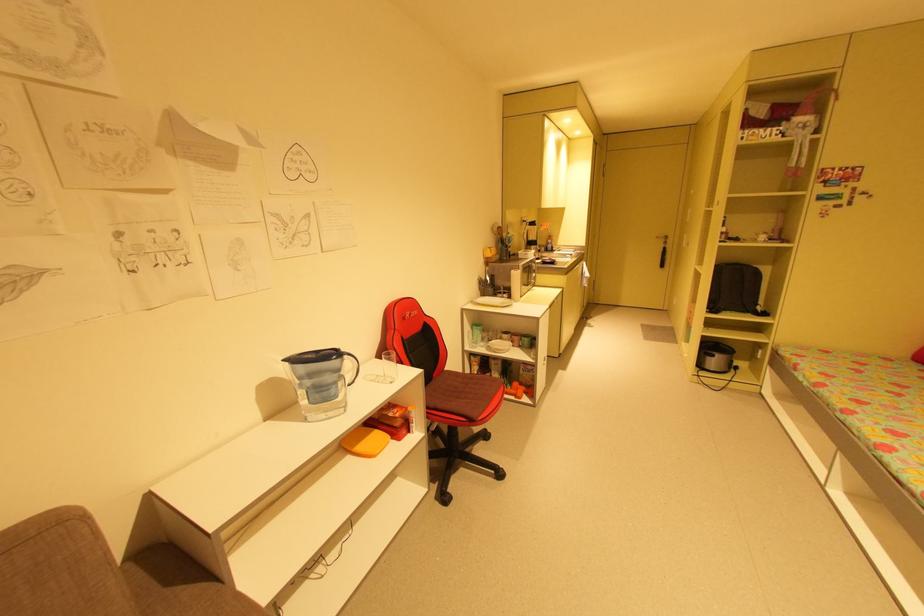
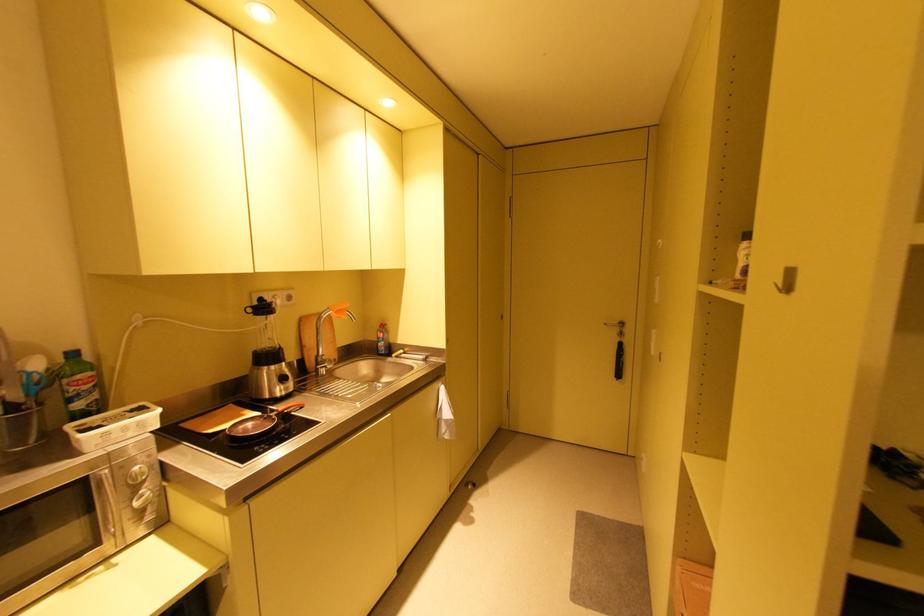
Which direction would the cameraman need to move to produce the second image?

The cameraman walked toward right, forward.